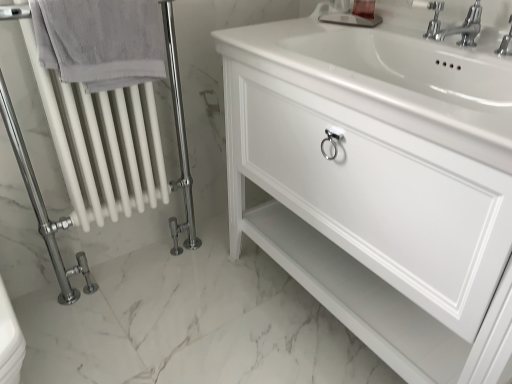
The image size is (512, 384). What are the coordinates of `vacant space positioned to the left of polished chrome faucet at upper right` in the screenshot? It's located at (368, 35).